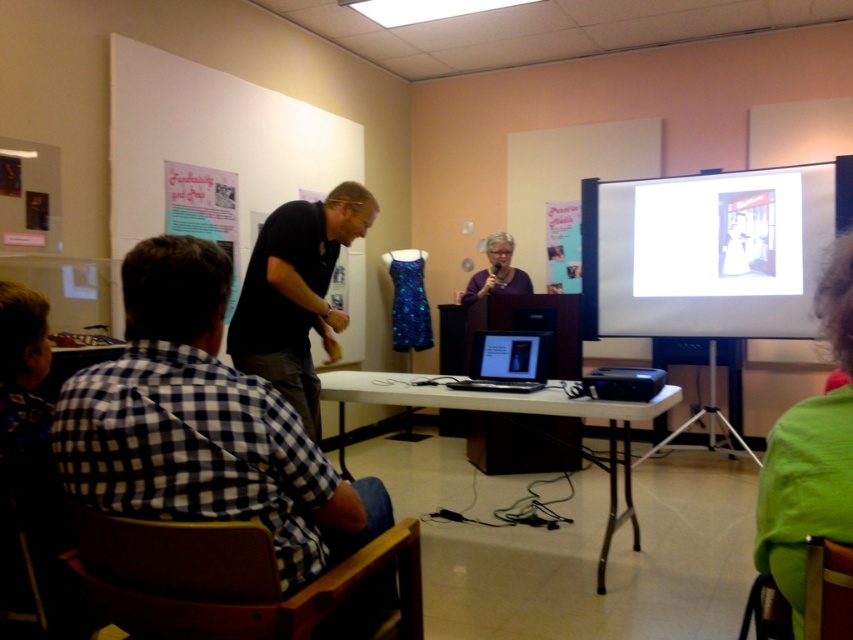
Between green fuzzy hair at lower right and purple fabric at center, which one has more height?

green fuzzy hair at lower right is taller.

Can you confirm if green fuzzy hair at lower right is positioned above purple fabric at center?

Actually, green fuzzy hair at lower right is below purple fabric at center.

Where is `green fuzzy hair at lower right`? green fuzzy hair at lower right is located at coordinates (810, 454).

Does black matte shirt at center appear on the left side of purple fabric at center?

Yes, black matte shirt at center is to the left of purple fabric at center.

From the picture: Who is higher up, black matte shirt at center or purple fabric at center?

purple fabric at center

Who is more forward, (306, 433) or (519, 275)?

Point (306, 433)

You are a GUI agent. You are given a task and a screenshot of the screen. Output one action in this format:
    pyautogui.click(x=<x>, y=<y>)
    Task: Click on the black matte shirt at center
    The height and width of the screenshot is (640, 853).
    Given the screenshot: What is the action you would take?
    pyautogui.click(x=296, y=294)

Who is lower down, white matte projection screen at upper right or black glossy laptop at center?

black glossy laptop at center is below.

Can you confirm if white matte projection screen at upper right is positioned to the left of black glossy laptop at center?

Incorrect, white matte projection screen at upper right is not on the left side of black glossy laptop at center.

Does point (675, 189) come behind point (543, 346)?

That is True.

You are a GUI agent. You are given a task and a screenshot of the screen. Output one action in this format:
    pyautogui.click(x=<x>, y=<y>)
    Task: Click on the white matte projection screen at upper right
    The height and width of the screenshot is (640, 853).
    Given the screenshot: What is the action you would take?
    pyautogui.click(x=706, y=252)